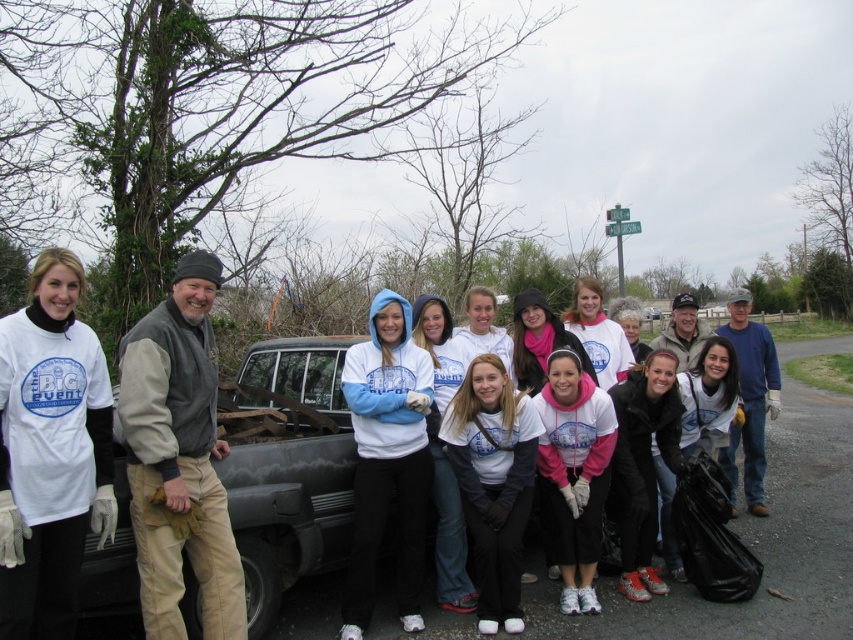
You are a photographer taking a picture of the group. You notice two points in the image at coordinates point (32,524) and point (165,464). Which point is closer to your camera?

Point (32,524) is closer to the camera than point (165,464).

You are standing at the origin of a coordinate system placed at the bottom left corner of the image. The white cotton tshirt at center is located at point (50, 452). If you want to walk directly to the white cotton tshirt at center, in which direction should you move?

The point (50, 452) is to the right and above your current position at the origin, so you should move northeast to reach the white cotton tshirt at center.